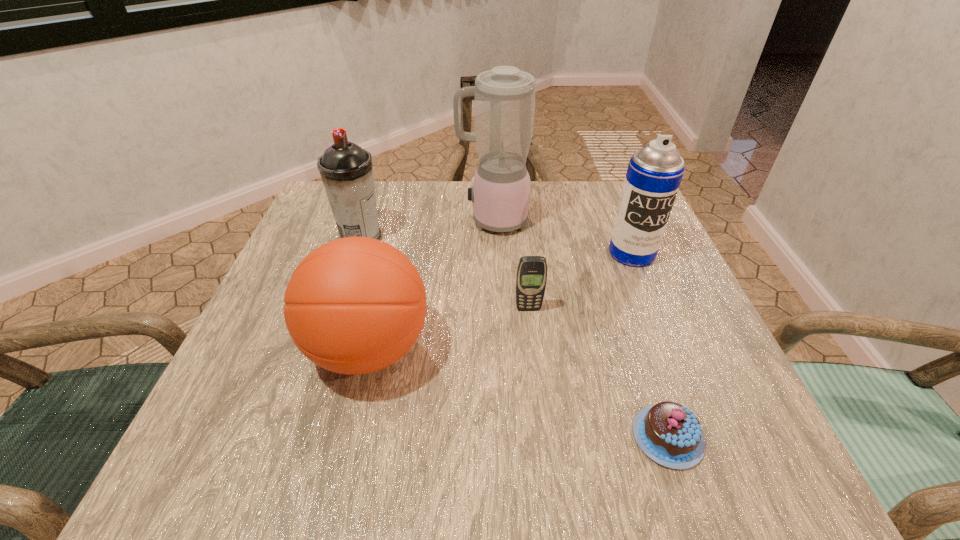
Select which object is the closest to the right aerosol can. Please provide its 2D coordinates. Your answer should be formatted as a tuple, i.e. [(x, y)], where the tuple contains the x and y coordinates of a point satisfying the conditions above.

[(504, 98)]

Locate an element on the screen. The height and width of the screenshot is (540, 960). the second closest object relative to the chocolate cake is located at coordinates (355, 305).

The height and width of the screenshot is (540, 960). Identify the location of vacant space that satisfies the following two spatial constraints: 1. on the base of the food processor near the control knob; 2. on the back side of the shortest object. (502, 437).

I want to click on vacant region that satisfies the following two spatial constraints: 1. on the base of the tallest object near the control knob; 2. on the front side of the left aerosol can, so click(493, 237).